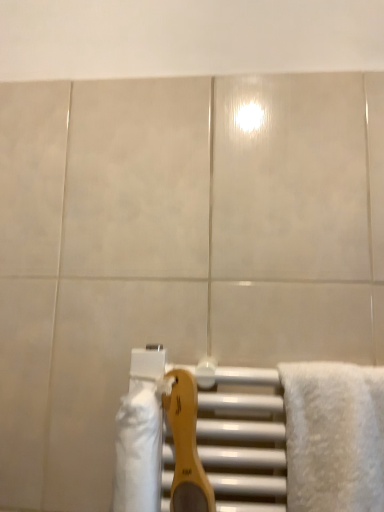
This screenshot has height=512, width=384. I want to click on white soft toilet paper at lower left, so click(138, 450).

Image resolution: width=384 pixels, height=512 pixels. Describe the element at coordinates (138, 450) in the screenshot. I see `white soft toilet paper at lower left` at that location.

I want to click on white soft toilet paper at lower left, so click(138, 450).